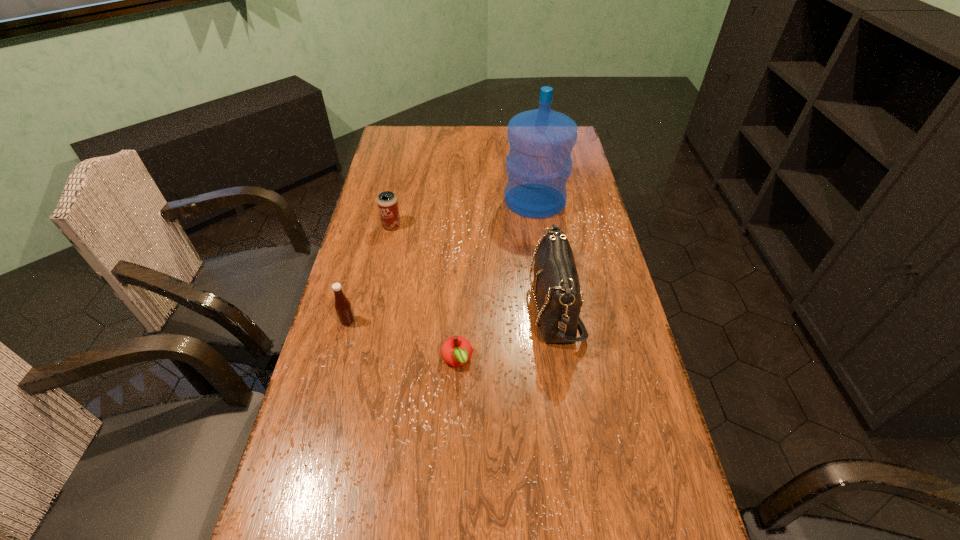
Find the location of a particular element. vacant area that lies between the handbag and the Tabasco sauce is located at coordinates (451, 313).

Locate an element on the screen. free space between the water jug and the beer can is located at coordinates (464, 213).

Where is `empty space that is in between the Tabasco sauce and the beer can`? The image size is (960, 540). empty space that is in between the Tabasco sauce and the beer can is located at coordinates (370, 273).

The width and height of the screenshot is (960, 540). I want to click on free spot between the third shortest object and the handbag, so click(473, 266).

The width and height of the screenshot is (960, 540). Identify the location of object that ranks as the fourth closest to the fifth shortest object. (343, 307).

Locate which object ranks fourth in proximity to the nearest object. Please provide its 2D coordinates. Your answer should be formatted as a tuple, i.e. [(x, y)], where the tuple contains the x and y coordinates of a point satisfying the conditions above.

[(387, 203)]

Find the location of a particular element. Image resolution: width=960 pixels, height=540 pixels. vacant space that satisfies the following two spatial constraints: 1. on the back side of the tallest object; 2. on the right side of the third object from right to left is located at coordinates (464, 200).